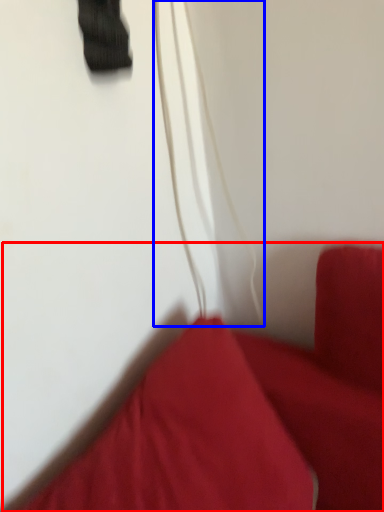
Question: Which point is further to the camera, furniture (highlighted by a red box) or string (highlighted by a blue box)?

Choices:
 (A) furniture
 (B) string

Answer: (B)